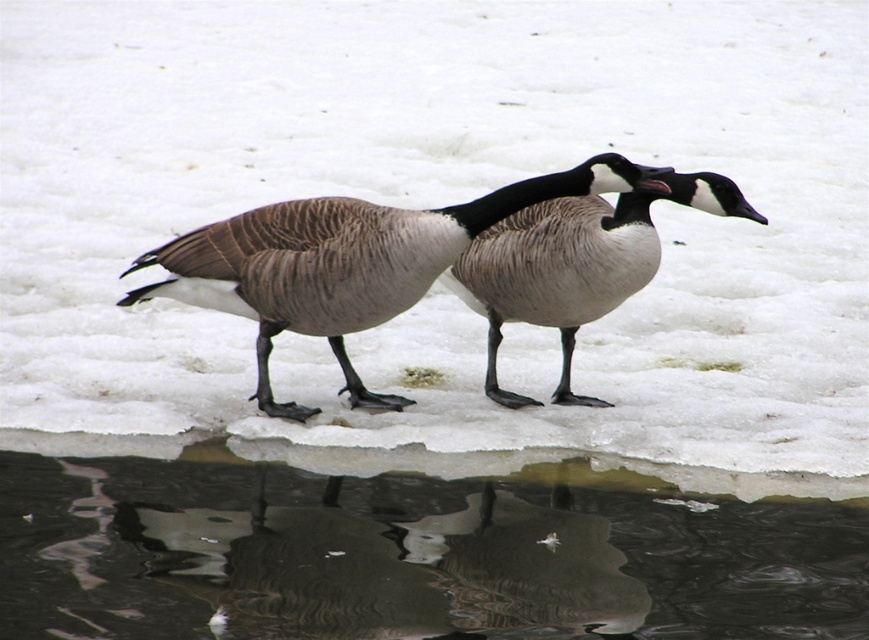
Question: Estimate the real-world distances between objects in this image. Which object is farther from the brown speckled goose at center?

Choices:
 (A) transparent ice at lower center
 (B) brown feathered goose at center

Answer: (A)

Question: Can you confirm if transparent ice at lower center is positioned to the left of brown feathered goose at center?

Choices:
 (A) no
 (B) yes

Answer: (A)

Question: Is transparent ice at lower center further to camera compared to brown feathered goose at center?

Choices:
 (A) no
 (B) yes

Answer: (A)

Question: Does transparent ice at lower center have a larger size compared to brown feathered goose at center?

Choices:
 (A) yes
 (B) no

Answer: (B)

Question: Which point appears farthest from the camera in this image?

Choices:
 (A) click(280, 611)
 (B) click(566, 205)
 (C) click(578, 179)

Answer: (B)

Question: Which object is positioned farthest from the brown feathered goose at center?

Choices:
 (A) transparent ice at lower center
 (B) brown speckled goose at center

Answer: (A)